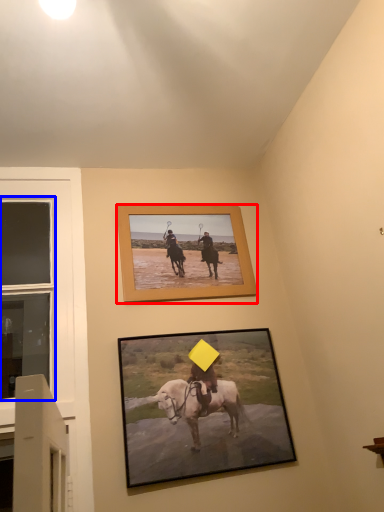
Question: Which of the following is the farthest to the observer, picture frame (highlighted by a red box) or window (highlighted by a blue box)?

Choices:
 (A) picture frame
 (B) window

Answer: (A)